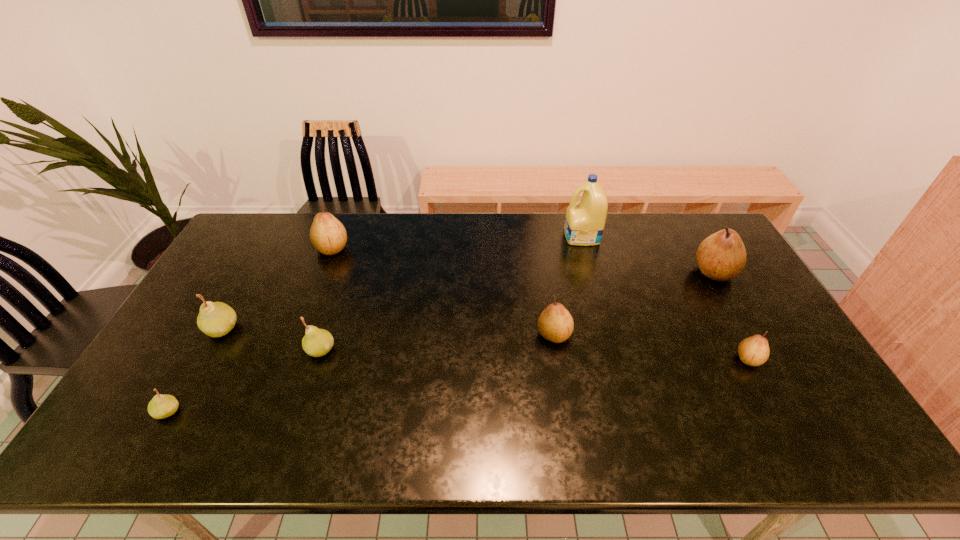
Identify the location of the sixth object from left to right. This screenshot has width=960, height=540. (584, 223).

At what (x,y) coordinates should I click in order to perform the action: click on the tallest object. Please return your answer as a coordinate pair (x, y). The image size is (960, 540). Looking at the image, I should click on click(584, 223).

Image resolution: width=960 pixels, height=540 pixels. In order to click on the seventh shortest object in this screenshot , I will do `click(722, 256)`.

Where is `the tallest pear`? the tallest pear is located at coordinates (722, 256).

In order to click on the second biggest brown pear in this screenshot , I will do `click(327, 234)`.

I want to click on the biggest green pear, so click(216, 319).

The height and width of the screenshot is (540, 960). In order to click on the second biggest green pear in this screenshot , I will do `click(317, 342)`.

Locate an element on the screen. This screenshot has width=960, height=540. the fifth object from left to right is located at coordinates (555, 323).

This screenshot has height=540, width=960. Identify the location of the second brown pear from left to right. (555, 323).

Locate an element on the screen. the nearest pear is located at coordinates (161, 406).